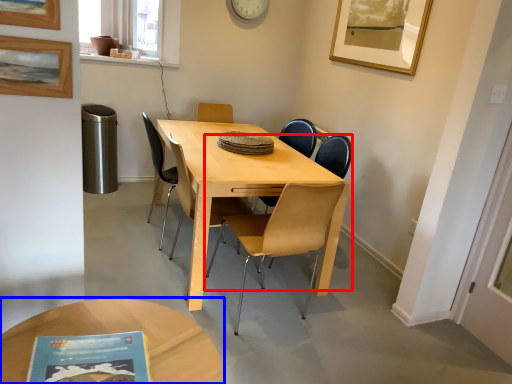
Question: Which object appears closest to the camera in this image, chair (highlighted by a red box) or coffee table (highlighted by a blue box)?

Choices:
 (A) chair
 (B) coffee table

Answer: (B)